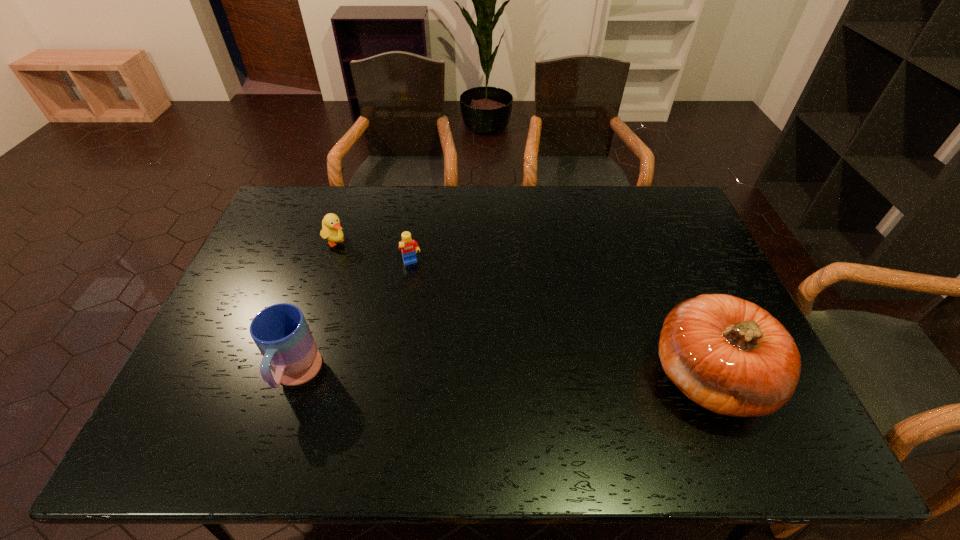
Where is `free spot located 0.270m on the front-facing side of the farthest object`? The width and height of the screenshot is (960, 540). free spot located 0.270m on the front-facing side of the farthest object is located at coordinates (397, 289).

This screenshot has height=540, width=960. I want to click on vacant area located 0.120m on the front-facing side of the farthest object, so click(367, 265).

Locate an element on the screen. The width and height of the screenshot is (960, 540). free space located 0.050m on the front-facing side of the farthest object is located at coordinates (353, 255).

Where is `mug at the near edge`? The image size is (960, 540). mug at the near edge is located at coordinates (281, 333).

This screenshot has height=540, width=960. Find the location of `pumpkin at the near edge`. pumpkin at the near edge is located at coordinates (730, 356).

This screenshot has height=540, width=960. I want to click on object located in the right edge section of the desktop, so click(730, 356).

Locate an element on the screen. This screenshot has height=540, width=960. object present at the near right corner is located at coordinates (730, 356).

Identify the location of vacant space at the far edge of the desktop. The height and width of the screenshot is (540, 960). (558, 193).

The height and width of the screenshot is (540, 960). In the image, there is a desktop. What are the coordinates of `vacant space at the near edge` in the screenshot? It's located at (303, 402).

In order to click on blank space at the left edge of the desktop in this screenshot , I will do pos(235,322).